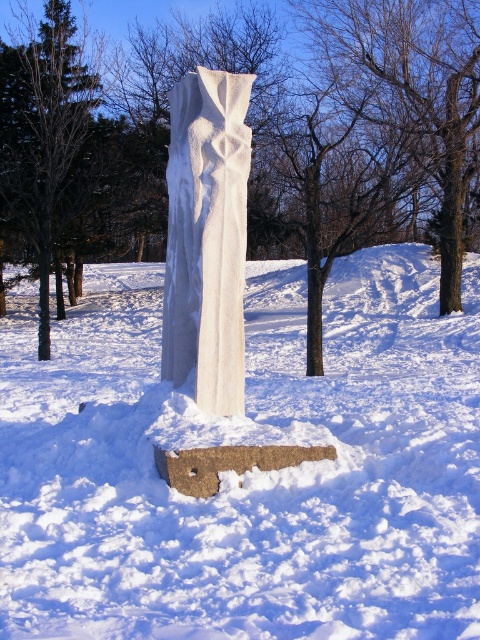
You are an artist planning to create a miniature model of the winter scene. You have a limited amount of material and want to ensure the white textured stone at center and the white marble column at center are scaled accurately. Which object should you allocate more material to based on their sizes?

The white textured stone at center is bigger than the white marble column at center, so you should allocate more material to the white textured stone at center to accurately represent its size in the miniature model.

What are the coordinates of the white stone column at center in the image?

The white stone column at center is located at coordinates (312, 132).